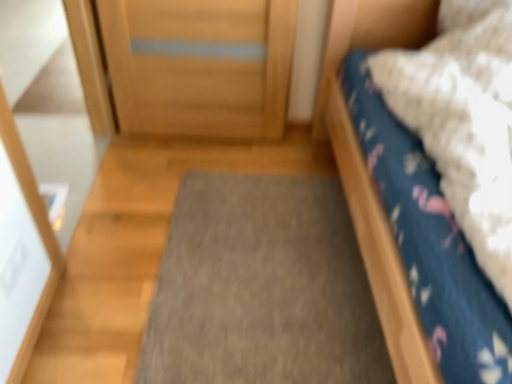
This screenshot has width=512, height=384. What are the coordinates of `vacant space situated above gray carpet at center (from a real-world perspective)` in the screenshot? It's located at (273, 259).